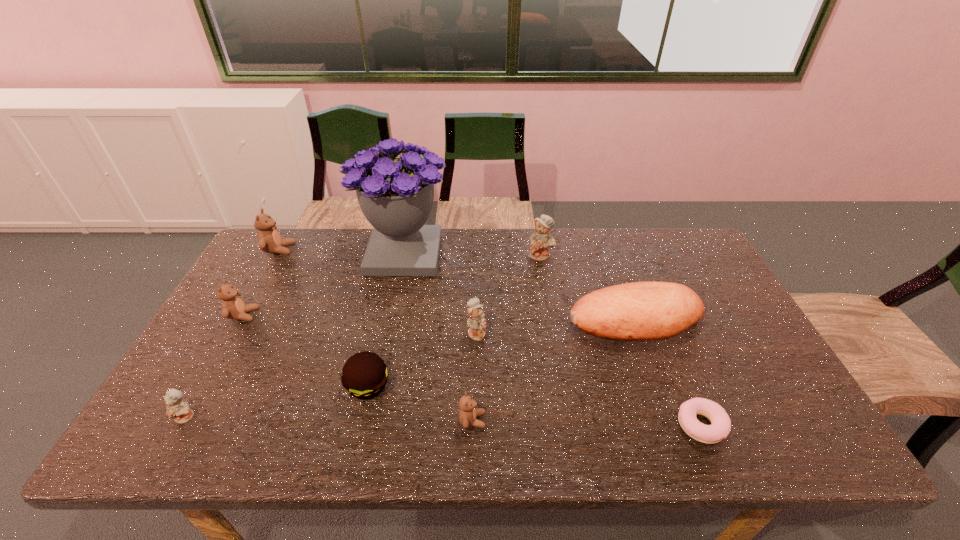
Locate an element on the screen. This screenshot has height=540, width=960. vacant space located 0.360m on the front-facing side of the second farthest brown teddy bear is located at coordinates (384, 315).

Locate an element on the screen. This screenshot has width=960, height=540. vacant space located 0.050m on the back of the bread is located at coordinates (622, 285).

Locate an element on the screen. free space located 0.310m on the right of the patty is located at coordinates (518, 386).

I want to click on free spot located on the front-facing side of the smallest brown teddy bear, so click(599, 420).

At what (x,y) coordinates should I click in order to perform the action: click on vacant space located 0.350m on the back of the purple doughnut. Please return your answer as a coordinate pair (x, y). The height and width of the screenshot is (540, 960). Looking at the image, I should click on coord(650,301).

Where is `bouquet that is at the far edge`? The height and width of the screenshot is (540, 960). bouquet that is at the far edge is located at coordinates 396,195.

Image resolution: width=960 pixels, height=540 pixels. Identify the location of doughnut located at the near edge. click(x=720, y=427).

This screenshot has height=540, width=960. Identify the location of object at the right edge. (638, 311).

This screenshot has width=960, height=540. I want to click on object present at the far left corner, so click(269, 240).

Find the location of a particular element. The width and height of the screenshot is (960, 540). object present at the near left corner is located at coordinates (176, 408).